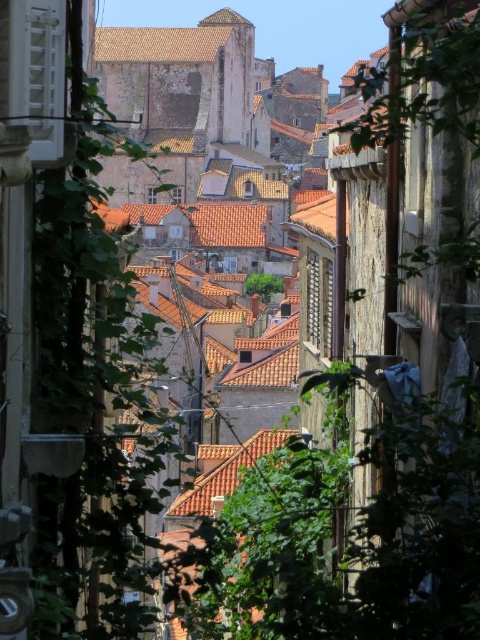
You are standing at the entrance of the alleyway and want to take a photo. There are two points of interest marked as point 1 at coordinates (151, 198) and point 2 at coordinates (100, 42). Which point will appear larger in your photo?

Point 1 at coordinates (151, 198) will appear larger in the photo because it is closer to the camera than point 2 at coordinates (100, 42).

You are standing in the narrow alleyway and want to place a small statue exactly halfway between point (119, 36) and point (216, 497). Since the alley is narrow, you need to ensure the statue won

The statue should be placed between the two points, but since point (119, 36) is behind point (216, 497), the statue will be closer to point (216, 497) than the midpoint of the two points.

You are a drone operator who needs to fly a drone from the brown textured roof at upper center to the terracotta tiled roof at center. The drone has a maximum flight range of 100 meters. Can you safely complete the flight without needing to recharge?

The distance between the brown textured roof at upper center and the terracotta tiled roof at center is 94.54 meters, which is within the drone operator drone has a maximum flight range of 100 meters. Therefore, the drone can safely complete the flight without needing to recharge.